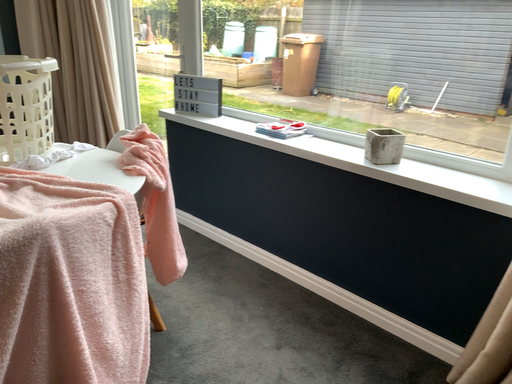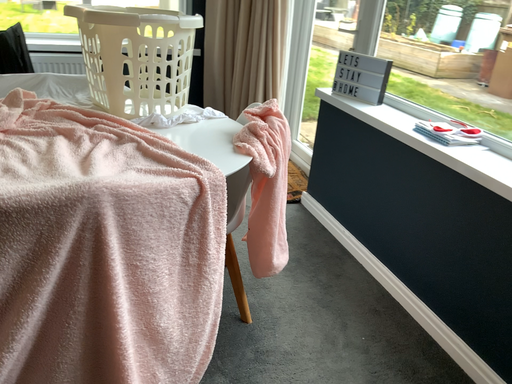
Question: Which way did the camera rotate in the video?

Choices:
 (A) rotated left
 (B) rotated right

Answer: (A)